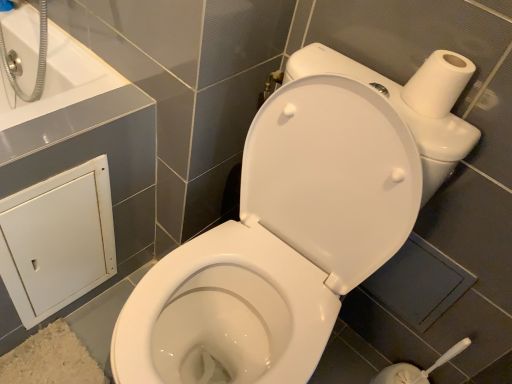
Question: Is white matte cabinet at lower left smaller than white glossy bathtub at upper left?

Choices:
 (A) no
 (B) yes

Answer: (B)

Question: Is white matte cabinet at lower left further to camera compared to white glossy bathtub at upper left?

Choices:
 (A) yes
 (B) no

Answer: (B)

Question: From the image's perspective, is white matte cabinet at lower left beneath white glossy bathtub at upper left?

Choices:
 (A) no
 (B) yes

Answer: (B)

Question: Is white matte cabinet at lower left shorter than white glossy bathtub at upper left?

Choices:
 (A) yes
 (B) no

Answer: (B)

Question: Can you confirm if white matte cabinet at lower left is positioned to the right of white glossy bathtub at upper left?

Choices:
 (A) no
 (B) yes

Answer: (B)

Question: Do you think dark gray tile at lower right is within white matte toilet paper at upper right, or outside of it?

Choices:
 (A) outside
 (B) inside

Answer: (A)

Question: Is dark gray tile at lower right bigger or smaller than white matte toilet paper at upper right?

Choices:
 (A) small
 (B) big

Answer: (B)

Question: Visually, is dark gray tile at lower right positioned to the left or to the right of white matte toilet paper at upper right?

Choices:
 (A) right
 (B) left

Answer: (A)

Question: From their relative heights in the image, would you say dark gray tile at lower right is taller or shorter than white matte toilet paper at upper right?

Choices:
 (A) short
 (B) tall

Answer: (B)

Question: Is white matte cabinet at lower left in front of or behind white matte toilet paper at upper right in the image?

Choices:
 (A) behind
 (B) front

Answer: (A)

Question: Is white matte cabinet at lower left to the left or to the right of white matte toilet paper at upper right in the image?

Choices:
 (A) right
 (B) left

Answer: (B)

Question: Does point [16, 309] appear closer or farther from the camera than point [425, 72]?

Choices:
 (A) closer
 (B) farther

Answer: (B)

Question: From a real-world perspective, is white matte cabinet at lower left positioned above or below white matte toilet paper at upper right?

Choices:
 (A) above
 (B) below

Answer: (B)

Question: In terms of width, does white matte toilet paper at upper right look wider or thinner when compared to white glossy bathtub at upper left?

Choices:
 (A) thin
 (B) wide

Answer: (A)

Question: From the image's perspective, relative to white glossy bathtub at upper left, is white matte toilet paper at upper right above or below?

Choices:
 (A) below
 (B) above

Answer: (A)